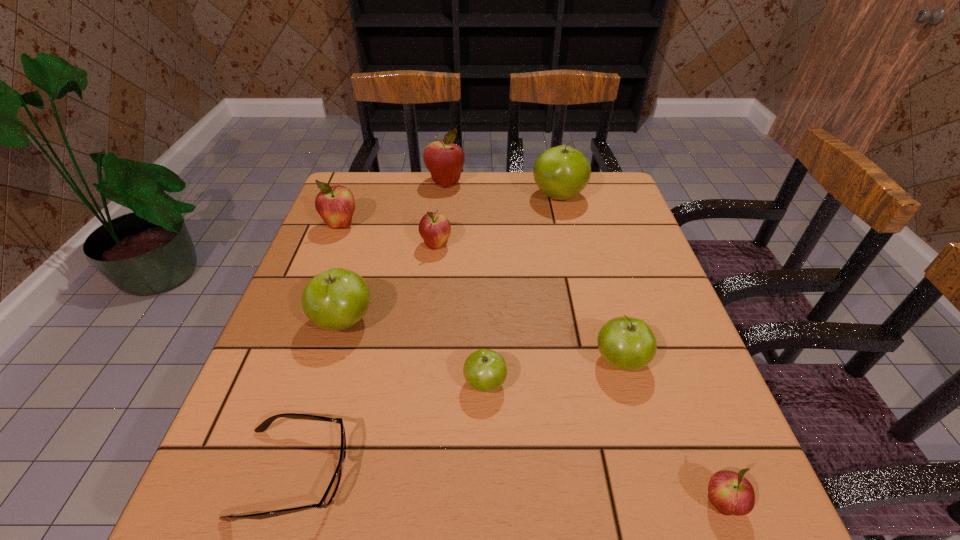
Identify the location of the closest green apple to the shortest object. (336, 299).

Find the location of `vacant space that satisfies the following two spatial constraints: 1. on the back side of the biggest green apple; 2. on the right side of the third biggest red apple`. vacant space that satisfies the following two spatial constraints: 1. on the back side of the biggest green apple; 2. on the right side of the third biggest red apple is located at coordinates (442, 197).

What are the coordinates of `free space that satisfies the following two spatial constraints: 1. on the front side of the third biggest green apple; 2. on the right side of the third smallest red apple` in the screenshot? It's located at (288, 361).

You are a GUI agent. You are given a task and a screenshot of the screen. Output one action in this format:
    pyautogui.click(x=<x>, y=<y>)
    Task: Click on the free space that satisfies the following two spatial constraints: 1. on the back side of the farthest green apple; 2. on the left side of the third green apple from right to left
    The width and height of the screenshot is (960, 540).
    Given the screenshot: What is the action you would take?
    pyautogui.click(x=483, y=197)